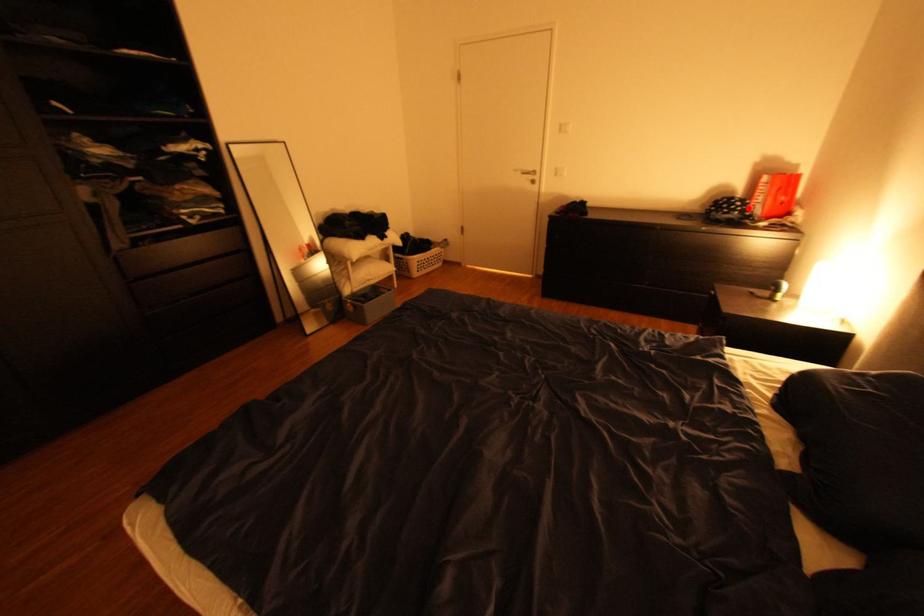
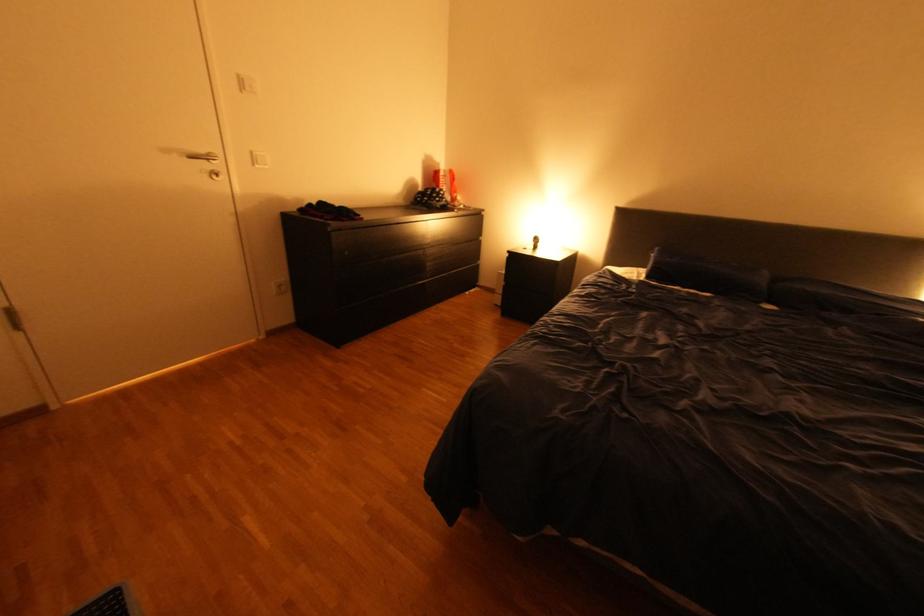
The point at the highlighted location is marked in the first image. Where is the corresponding point in the second image?

(454, 196)